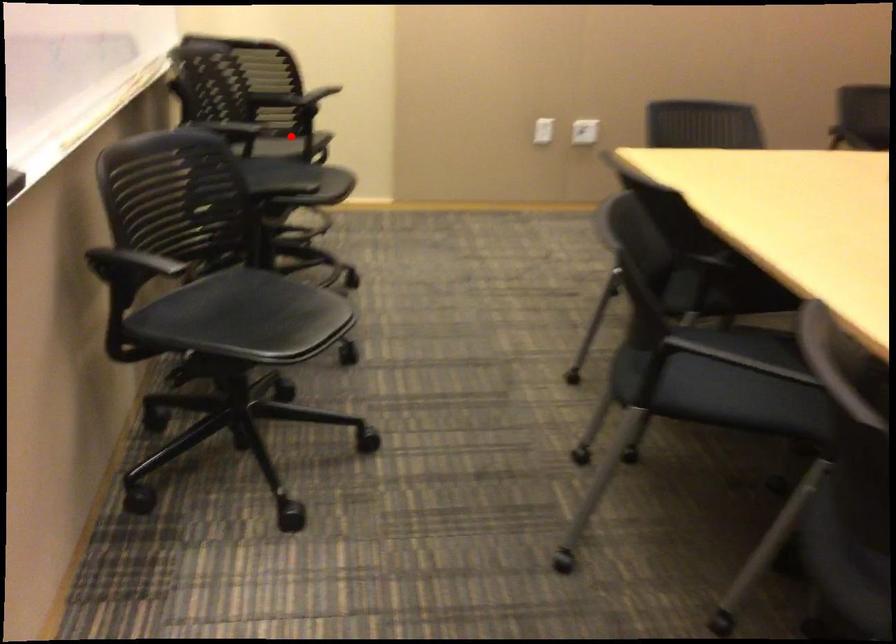
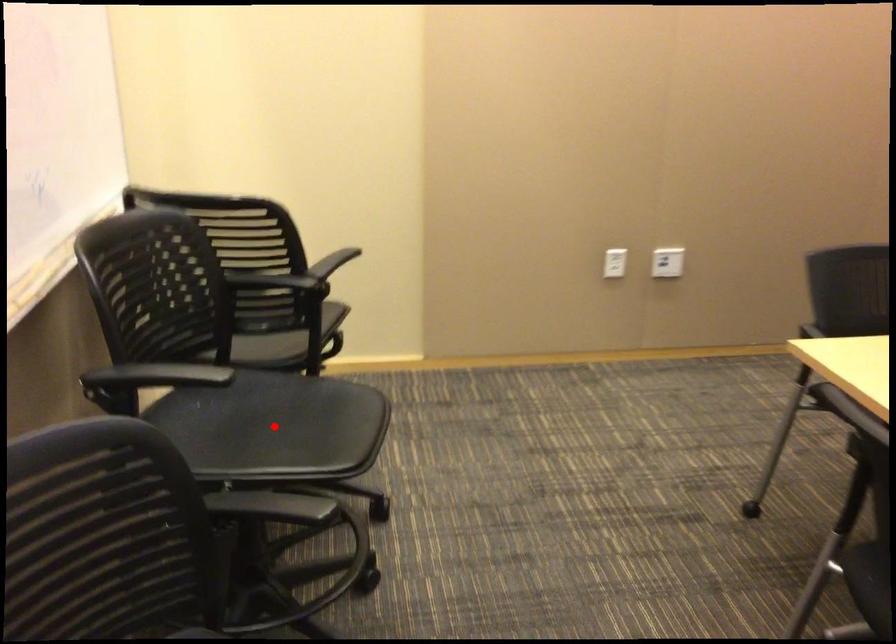
I am providing you with two images of the same scene from different viewpoints. A red point is marked on the first image and another point is marked on the second image. Is the marked point in image1 the same physical position as the marked point in image2?

No